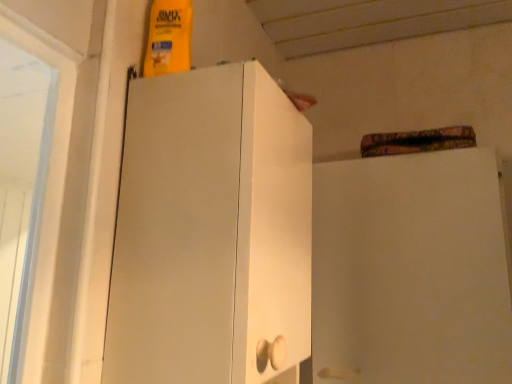
Describe the element at coordinates (211, 231) in the screenshot. This screenshot has width=512, height=384. I see `white matte cabinet at left` at that location.

This screenshot has width=512, height=384. In order to click on white matte cabinet at left in this screenshot , I will do `click(211, 231)`.

Identify the location of white matte cabinet at upper right. The image size is (512, 384). (410, 271).

Image resolution: width=512 pixels, height=384 pixels. Describe the element at coordinates (410, 271) in the screenshot. I see `white matte cabinet at upper right` at that location.

Identify the location of white matte cabinet at left. This screenshot has height=384, width=512. (211, 231).

Based on their positions, is white matte cabinet at left located to the left or right of white matte cabinet at upper right?

white matte cabinet at left is to the left of white matte cabinet at upper right.

Considering their positions, is white matte cabinet at left located in front of or behind white matte cabinet at upper right?

Visually, white matte cabinet at left is located in front of white matte cabinet at upper right.

Considering the points (233, 219) and (387, 248), which point is behind, point (233, 219) or point (387, 248)?

Point (387, 248)

From the image's perspective, would you say white matte cabinet at left is positioned over white matte cabinet at upper right?

Yes, from the image's perspective, white matte cabinet at left is on top of white matte cabinet at upper right.

From a real-world perspective, is white matte cabinet at left above or below white matte cabinet at upper right?

white matte cabinet at left is above white matte cabinet at upper right.

From the picture: Between white matte cabinet at left and white matte cabinet at upper right, which one has smaller width?

With smaller width is white matte cabinet at upper right.

Which of these two, white matte cabinet at left or white matte cabinet at upper right, stands shorter?

Standing shorter between the two is white matte cabinet at left.

Considering the sizes of white matte cabinet at left and white matte cabinet at upper right in the image, is white matte cabinet at left bigger or smaller than white matte cabinet at upper right?

Considering their sizes, white matte cabinet at left takes up less space than white matte cabinet at upper right.

Choose the correct answer: Is white matte cabinet at left inside white matte cabinet at upper right or outside it?

white matte cabinet at left is not inside white matte cabinet at upper right, it's outside.

Are white matte cabinet at left and white matte cabinet at upper right making contact?

white matte cabinet at left is not next to white matte cabinet at upper right, and they're not touching.

Is white matte cabinet at left oriented towards white matte cabinet at upper right?

No, white matte cabinet at left is not facing towards white matte cabinet at upper right.

Find the location of a particular element. cabinetry below the white matte cabinet at left (from a real-world perspective) is located at coordinates (410, 271).

Is white matte cabinet at upper right to the right of white matte cabinet at left from the viewer's perspective?

Indeed, white matte cabinet at upper right is positioned on the right side of white matte cabinet at left.

Which object is more forward, white matte cabinet at upper right or white matte cabinet at left?

white matte cabinet at left is closer to the camera.

Is point (490, 149) in front of point (308, 349)?

No, it is not.

From the image's perspective, is white matte cabinet at upper right on white matte cabinet at left?

No, from the image's perspective, white matte cabinet at upper right is not over white matte cabinet at left.

From a real-world perspective, is white matte cabinet at upper right over white matte cabinet at left?

No, from a real-world perspective, white matte cabinet at upper right is not above white matte cabinet at left.

From the picture: Considering the sizes of objects white matte cabinet at upper right and white matte cabinet at left in the image provided, who is thinner, white matte cabinet at upper right or white matte cabinet at left?

Thinner between the two is white matte cabinet at upper right.

Can you confirm if white matte cabinet at upper right is shorter than white matte cabinet at left?

Incorrect, the height of white matte cabinet at upper right does not fall short of that of white matte cabinet at left.

Looking at this image, between white matte cabinet at upper right and white matte cabinet at left, which one has smaller size?

white matte cabinet at left.

Is white matte cabinet at upper right inside or outside of white matte cabinet at left?

white matte cabinet at upper right is located beyond the bounds of white matte cabinet at left.

Is white matte cabinet at upper right beside white matte cabinet at left?

No, white matte cabinet at upper right is not beside white matte cabinet at left.

Is white matte cabinet at left at the back of white matte cabinet at upper right?

white matte cabinet at upper right is not turned away from white matte cabinet at left.

How far apart are white matte cabinet at upper right and white matte cabinet at left?

36.27 centimeters.

Find the location of a particular element. Image resolution: width=512 pixels, height=384 pixels. cabinetry that is on the right side of white matte cabinet at left is located at coordinates (410, 271).

Where is `cupboard located on the left of white matte cabinet at upper right`? This screenshot has width=512, height=384. cupboard located on the left of white matte cabinet at upper right is located at coordinates (211, 231).

Where is `cupboard above the white matte cabinet at upper right (from the image's perspective)`? cupboard above the white matte cabinet at upper right (from the image's perspective) is located at coordinates (211, 231).